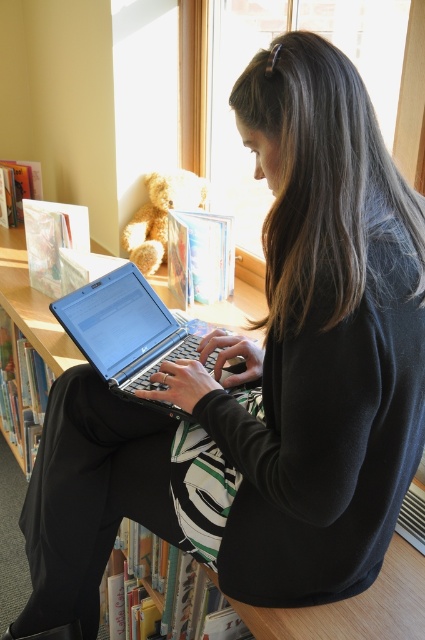
Can you confirm if wooden bookcase at center is positioned above satin black laptop at center?

No, wooden bookcase at center is not above satin black laptop at center.

Between wooden bookcase at center and satin black laptop at center, which one has less height?

satin black laptop at center is shorter.

Who is more forward, [161,294] or [87,298]?

Point [87,298] is more forward.

Where is `wooden bookcase at center`? wooden bookcase at center is located at coordinates (25, 349).